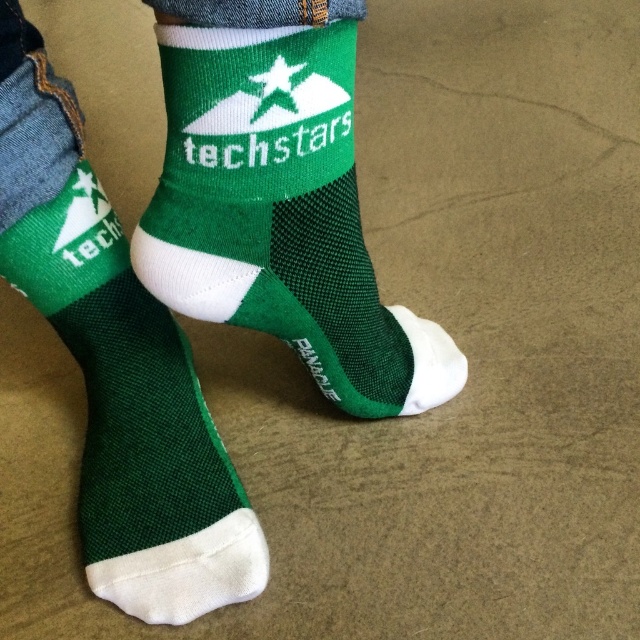
You are designing a virtual reality game where players must locate specific items in a 3D environment. The game uses a coordinate system where the center of the screen is at point 0.5, 0.5. If you want players to find the green mesh socks at center, what coordinates should they aim for?

The green mesh socks at center should be located at coordinates (195,275), so players should aim for those coordinates to find them.

You are trying to determine if the green mesh socks at center can fit into a drawer that is exactly the width of the green mesh sock at center. Can they fit without overlapping?

The green mesh socks at center might be wider than green mesh sock at center, so they might not fit without overlapping.